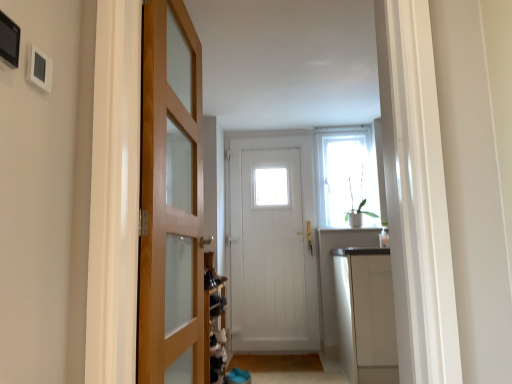
Question: Considering the positions of green matte plant at upper right and brown carpet at lower center, acting as the 2th path starting from the back, in the image, is green matte plant at upper right wider or thinner than brown carpet at lower center, acting as the 2th path starting from the back,?

Choices:
 (A) wide
 (B) thin

Answer: (B)

Question: Is green matte plant at upper right taller or shorter than brown carpet at lower center, acting as the 2th path starting from the back?

Choices:
 (A) short
 (B) tall

Answer: (B)

Question: Which object is positioned farthest from the wooden door at left, the second door when ordered from back to front?

Choices:
 (A) brown wooden mat at lower center, the 2th path viewed from the front
 (B) white wooden door at center, which appears as the first door when viewed from the back
 (C) brown carpet at lower center, which is the 1th path from front to back
 (D) white glossy cabinet at right
 (E) green matte plant at upper right

Answer: (E)

Question: Estimate the real-world distances between objects in this image. Which object is farther from the white glossy cabinet at right?

Choices:
 (A) brown carpet at lower center, which is the 1th path from front to back
 (B) white wooden door at center, arranged as the 2th door when viewed from the front
 (C) wooden door at left, the 2th door when ordered from right to left
 (D) clear glass window at upper center
 (E) brown wooden mat at lower center, the 2th path viewed from the front

Answer: (C)